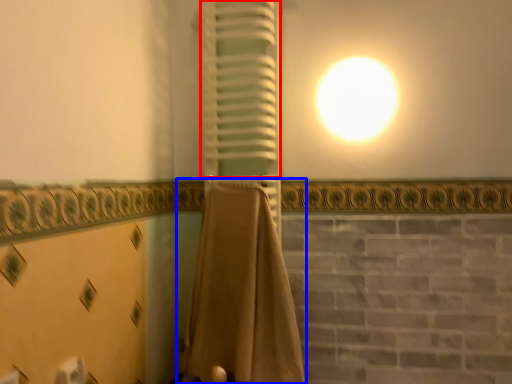
Question: Which point is further to the camera, curtain (highlighted by a red box) or curtain (highlighted by a blue box)?

Choices:
 (A) curtain
 (B) curtain

Answer: (A)